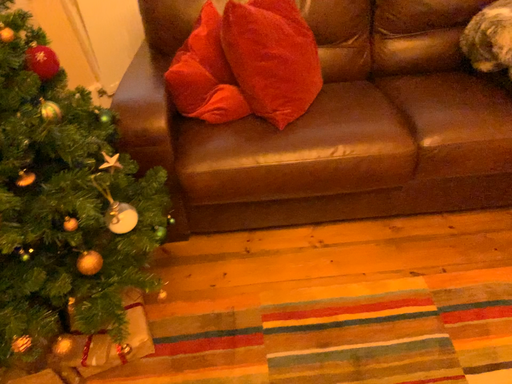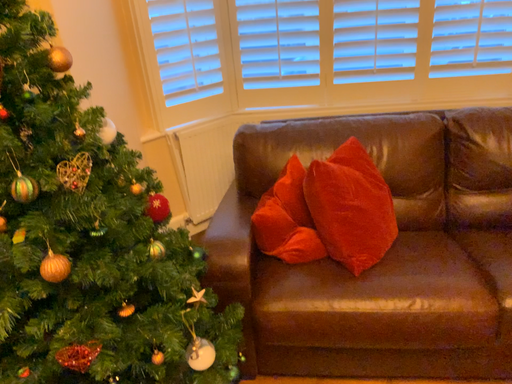
Question: Which way did the camera rotate in the video?

Choices:
 (A) rotated downward
 (B) rotated upward

Answer: (B)